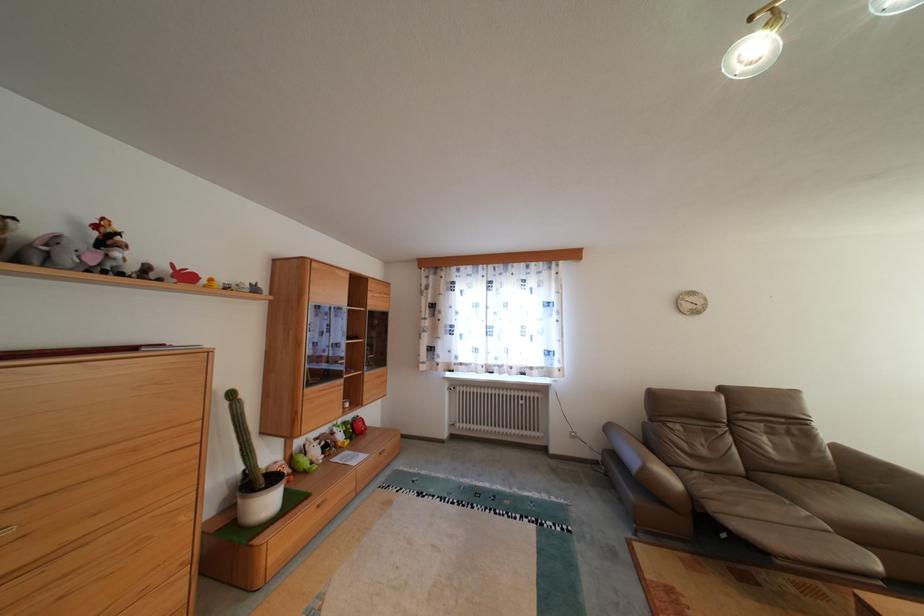
Image resolution: width=924 pixels, height=616 pixels. I want to click on green stuffed frog, so click(x=307, y=456).